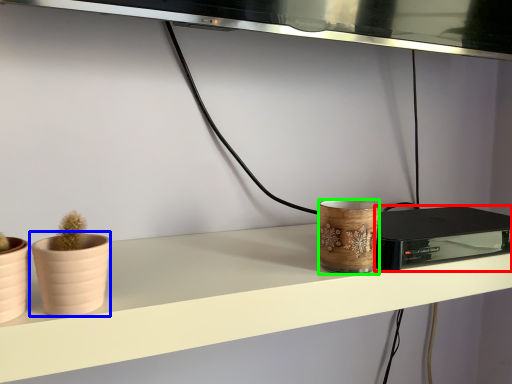
Question: Estimate the real-world distances between objects in this image. Which object is closer to appliance (highlighted by a red box), flowerpot (highlighted by a blue box) or pottery (highlighted by a green box)?

Choices:
 (A) flowerpot
 (B) pottery

Answer: (B)